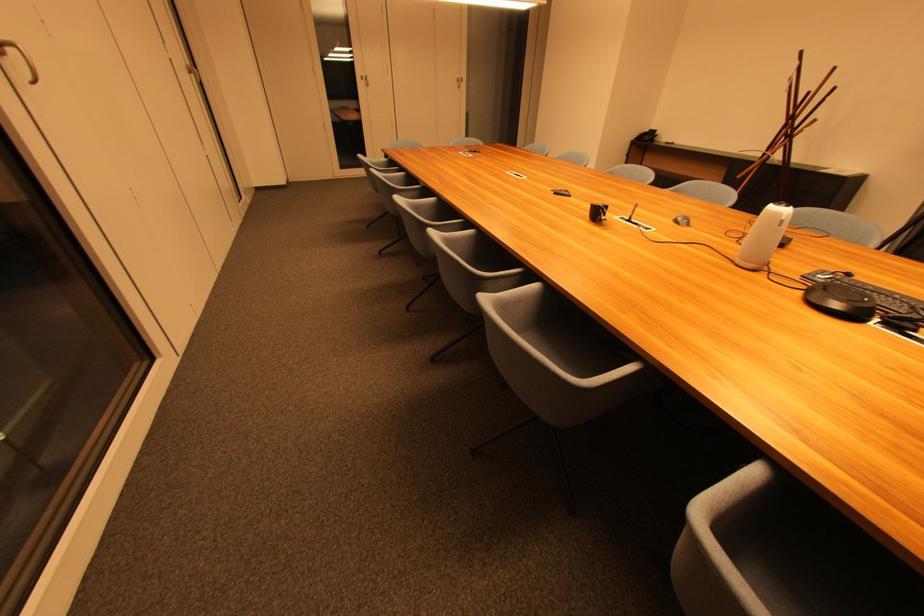
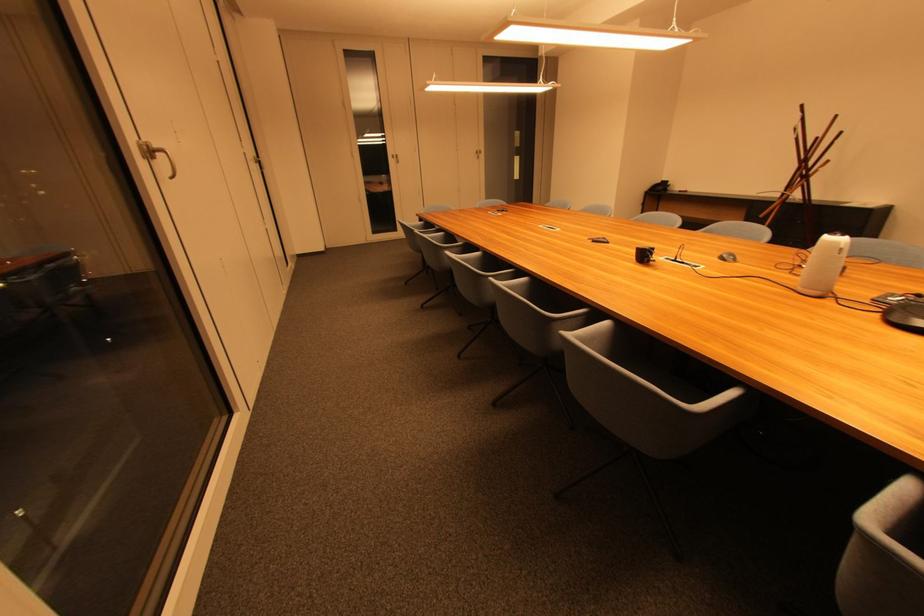
Find the pixel in the second image that matches (602,216) in the first image.

(649, 257)